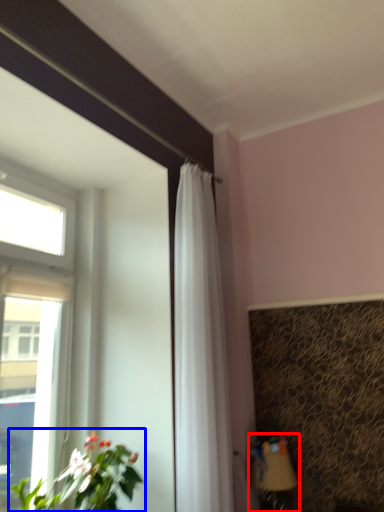
Question: Which object is closer to the camera taking this photo, table lamp (highlighted by a red box) or houseplant (highlighted by a blue box)?

Choices:
 (A) table lamp
 (B) houseplant

Answer: (B)